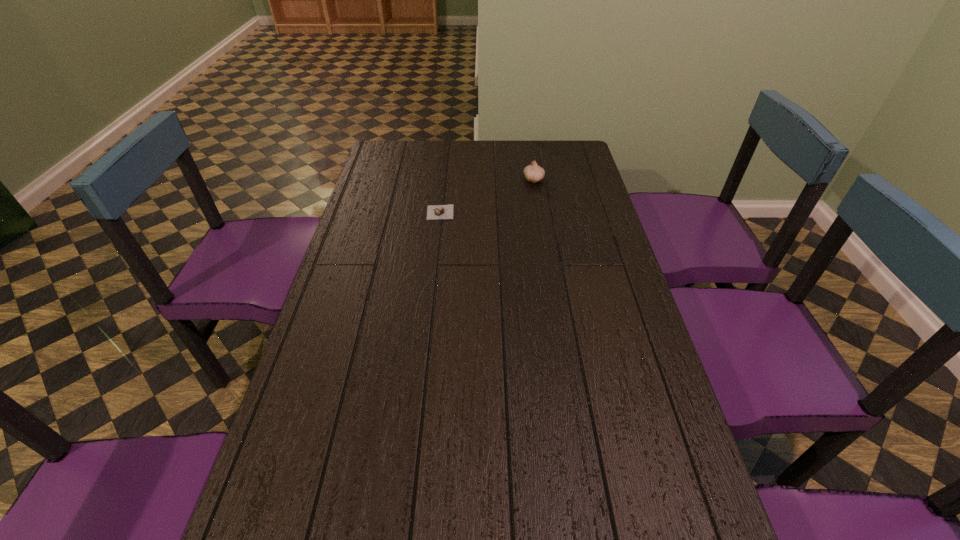
Locate an element on the screen. The width and height of the screenshot is (960, 540). the right object is located at coordinates 533,173.

Identify the location of the right garlic. This screenshot has width=960, height=540. (533, 173).

Where is `the nearer object`? The width and height of the screenshot is (960, 540). the nearer object is located at coordinates (434, 212).

Locate an element on the screen. the nearer garlic is located at coordinates (434, 212).

Locate an element on the screen. The height and width of the screenshot is (540, 960). vacant area located on the left of the taller object is located at coordinates (451, 180).

Identify the location of blank area located on the back of the nearer garlic. The height and width of the screenshot is (540, 960). (444, 172).

Identify the location of vacant area at the far edge. (528, 160).

I want to click on vacant space at the left edge, so click(373, 217).

You are a GUI agent. You are given a task and a screenshot of the screen. Output one action in this format:
    pyautogui.click(x=<x>, y=<y>)
    Task: Click on the free space at the right edge of the desktop
    
    Given the screenshot: What is the action you would take?
    pyautogui.click(x=604, y=264)

What are the coordinates of `free space at the far left corner of the desktop` in the screenshot? It's located at (397, 159).